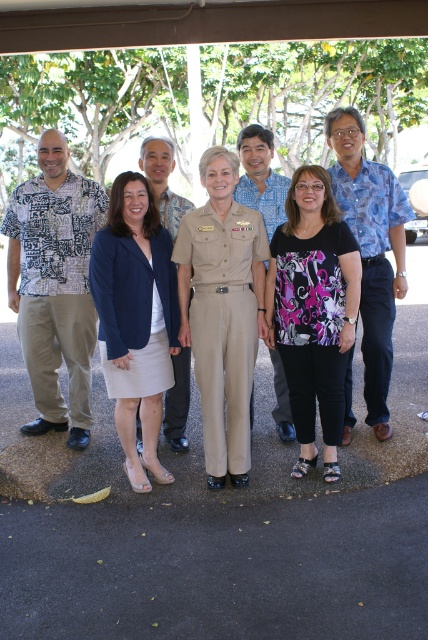
Question: Which point is closer to the camera?

Choices:
 (A) black printed blouse at center
 (B) navy blue fabric skirt at center

Answer: (A)

Question: Can you confirm if khaki uniform pants at center is positioned above navy blue fabric skirt at center?

Choices:
 (A) yes
 (B) no

Answer: (B)

Question: Which of the following is the farthest from the observer?

Choices:
 (A) (24, 259)
 (B) (351, 454)
 (C) (140, 356)

Answer: (A)

Question: Is printed cotton shirt at left positioned at the back of navy blue fabric skirt at center?

Choices:
 (A) yes
 (B) no

Answer: (A)

Question: Which object is the closest to the blue printed shirt at right?

Choices:
 (A) printed cotton shirt at left
 (B) navy blue fabric skirt at center
 (C) black printed blouse at center

Answer: (C)

Question: Is printed cotton shirt at left above khaki uniform pants at center?

Choices:
 (A) no
 (B) yes

Answer: (B)